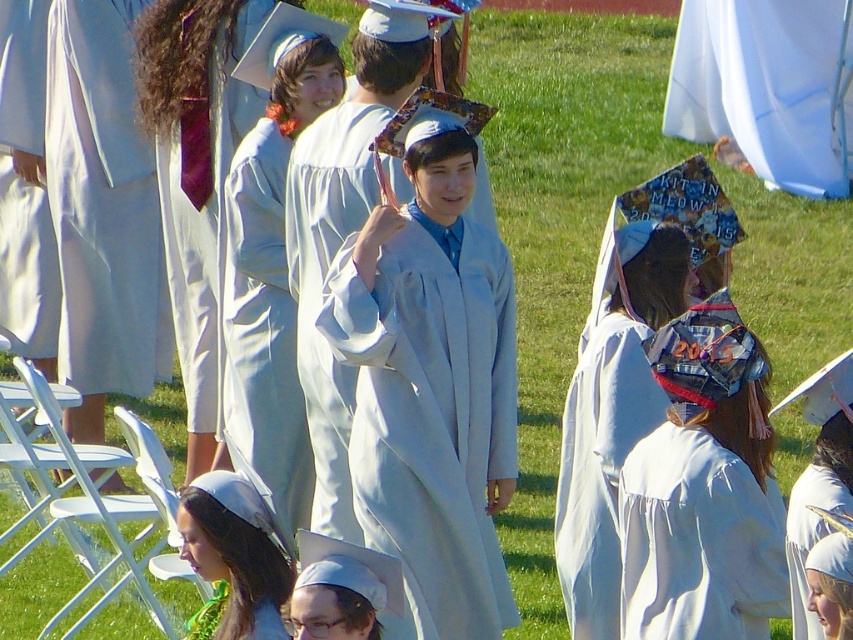
Can you confirm if light blue fabric gown at center is taller than matte white gown at center?

In fact, light blue fabric gown at center may be shorter than matte white gown at center.

This screenshot has height=640, width=853. What do you see at coordinates (431, 385) in the screenshot?
I see `light blue fabric gown at center` at bounding box center [431, 385].

This screenshot has height=640, width=853. Describe the element at coordinates (431, 385) in the screenshot. I see `light blue fabric gown at center` at that location.

Find the location of a particular element. light blue fabric gown at center is located at coordinates (431, 385).

Who is positioned more to the right, matte white gown at center or white matte gown at lower right?

white matte gown at lower right is more to the right.

Which is behind, point (297, 516) or point (799, 600)?

The point (297, 516) is more distant.

Locate an element on the screen. matte white gown at center is located at coordinates (271, 285).

Between matte white gown at center and white matte gown at left, which one is positioned higher?

white matte gown at left

Where is `matte white gown at center`? This screenshot has width=853, height=640. matte white gown at center is located at coordinates (271, 285).